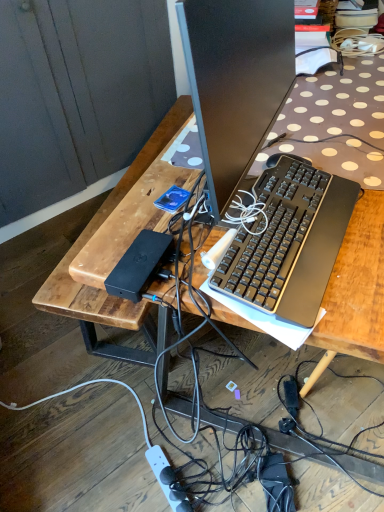
This screenshot has width=384, height=512. I want to click on free space to the right of white plastic power outlet at lower center, so click(x=214, y=472).